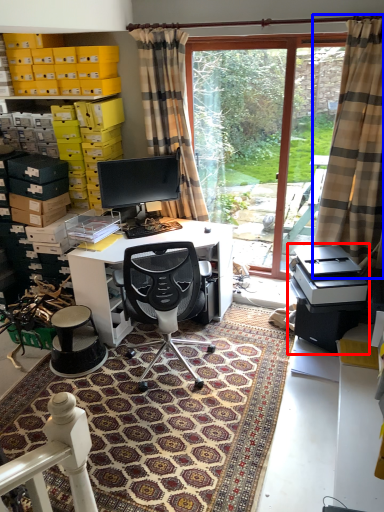
Question: Which object appears farthest to the camera in this image, printer (highlighted by a red box) or curtain (highlighted by a blue box)?

Choices:
 (A) printer
 (B) curtain

Answer: (A)